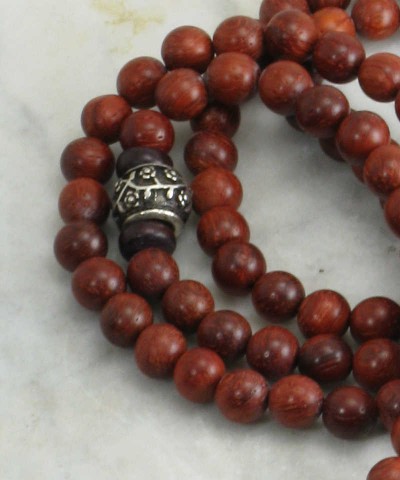
The width and height of the screenshot is (400, 480). I want to click on beige splotch mark on countertop, so click(137, 14), click(111, 6).